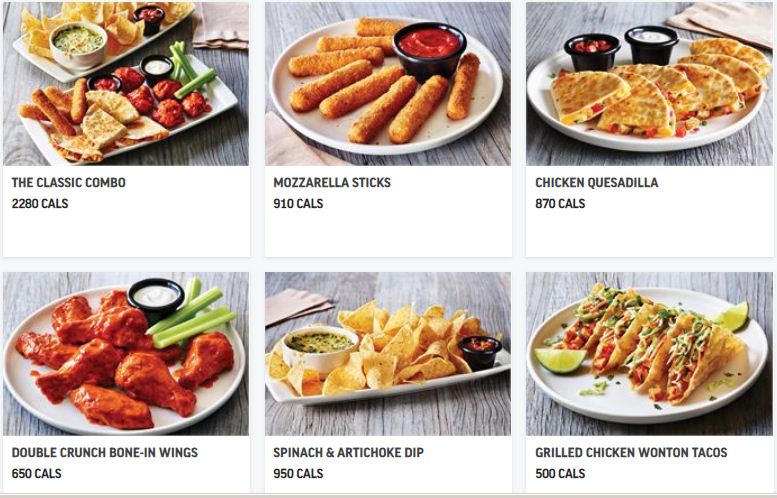
Locate an element on the screen. napkin is located at coordinates (709, 15), (280, 307), (215, 22).